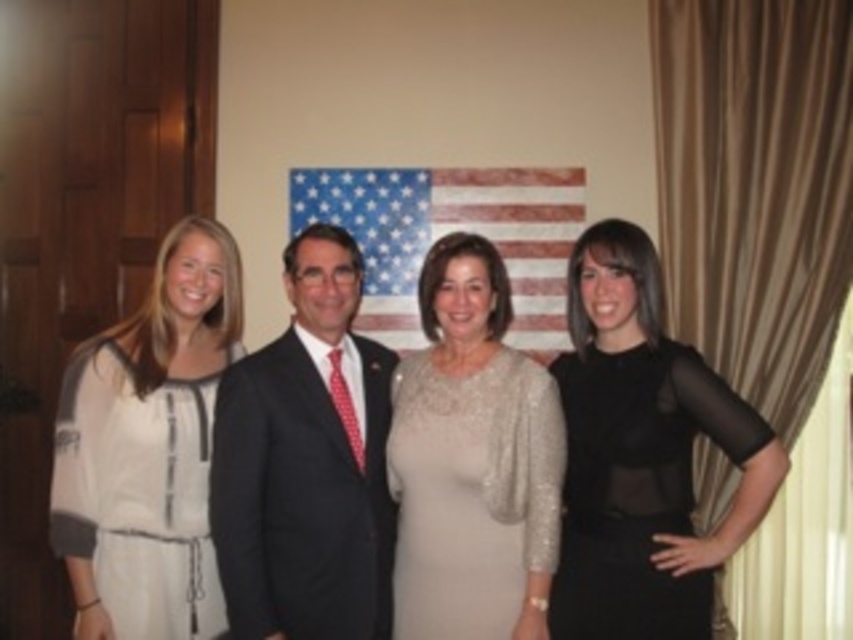
Does white sheer dress at left have a smaller size compared to matte white dress at center?

Indeed, white sheer dress at left has a smaller size compared to matte white dress at center.

Is the position of white sheer dress at left less distant than that of matte white dress at center?

No, white sheer dress at left is further to the viewer.

Image resolution: width=853 pixels, height=640 pixels. What do you see at coordinates (148, 448) in the screenshot?
I see `white sheer dress at left` at bounding box center [148, 448].

The width and height of the screenshot is (853, 640). In order to click on white sheer dress at left in this screenshot , I will do `click(148, 448)`.

Can you confirm if matte white dress at center is positioned to the left of american flag at center?

Indeed, matte white dress at center is positioned on the left side of american flag at center.

From the picture: Can you confirm if matte white dress at center is shorter than american flag at center?

No, matte white dress at center is not shorter than american flag at center.

Find the location of a particular element. matte white dress at center is located at coordinates (194, 301).

Is sequined beige dress at center below american flag at center?

Correct, sequined beige dress at center is located below american flag at center.

Is point (457, 237) less distant than point (335, 172)?

Yes, point (457, 237) is closer to viewer.

Between point (485, 522) and point (363, 326), which one is positioned behind?

The point (363, 326) is more distant.

This screenshot has height=640, width=853. I want to click on sequined beige dress at center, so click(473, 460).